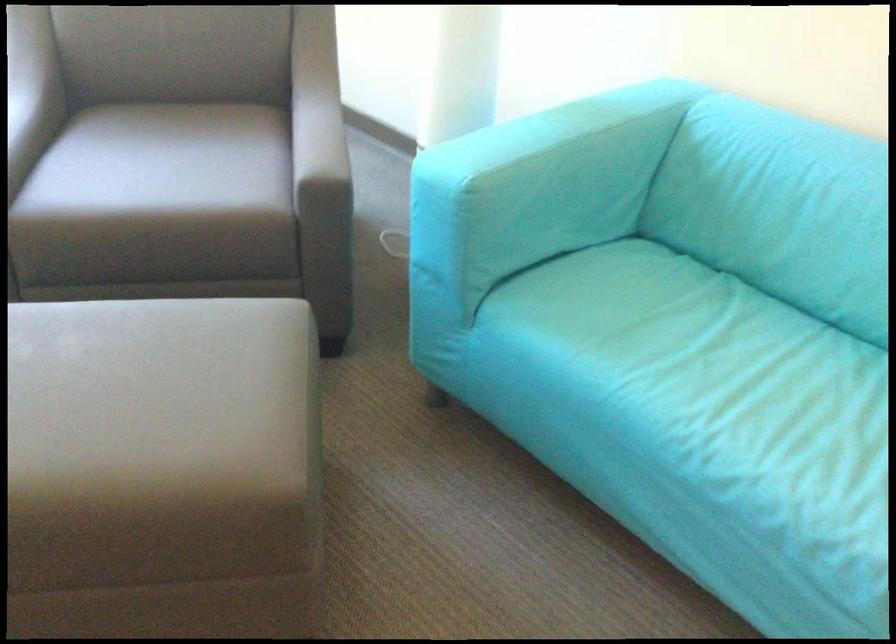
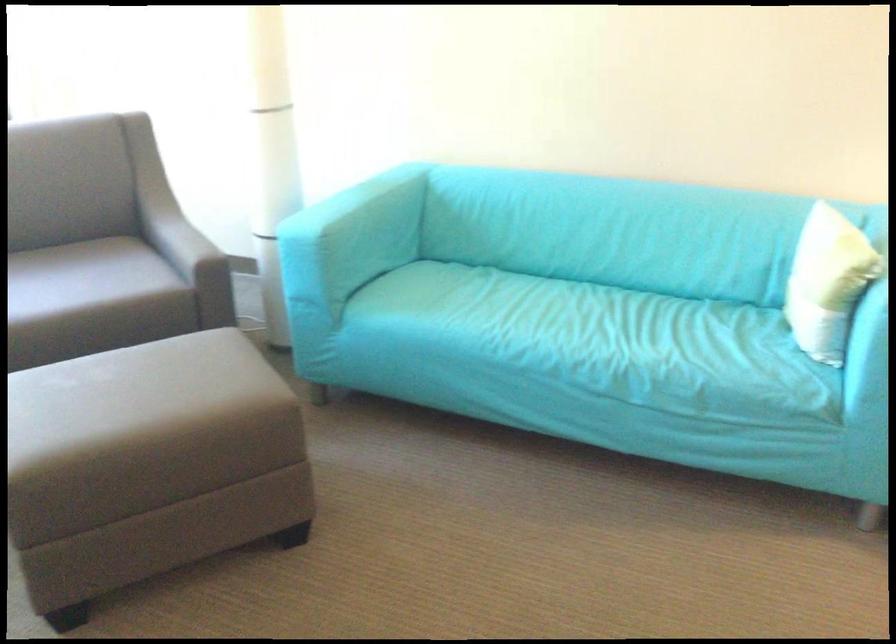
Locate, in the second image, the point that corresponds to (815,462) in the first image.

(556, 328)